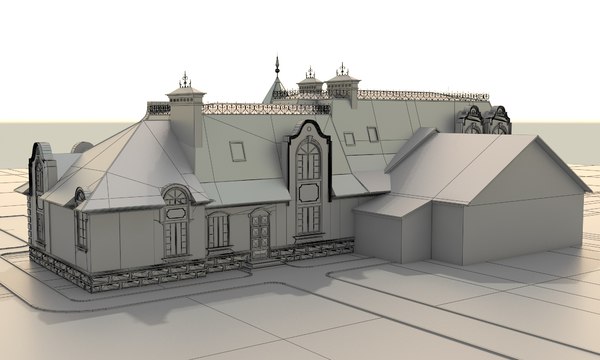
I want to click on walls, so click(60, 241), click(142, 241), click(385, 225), click(402, 230), click(448, 232), click(480, 232).